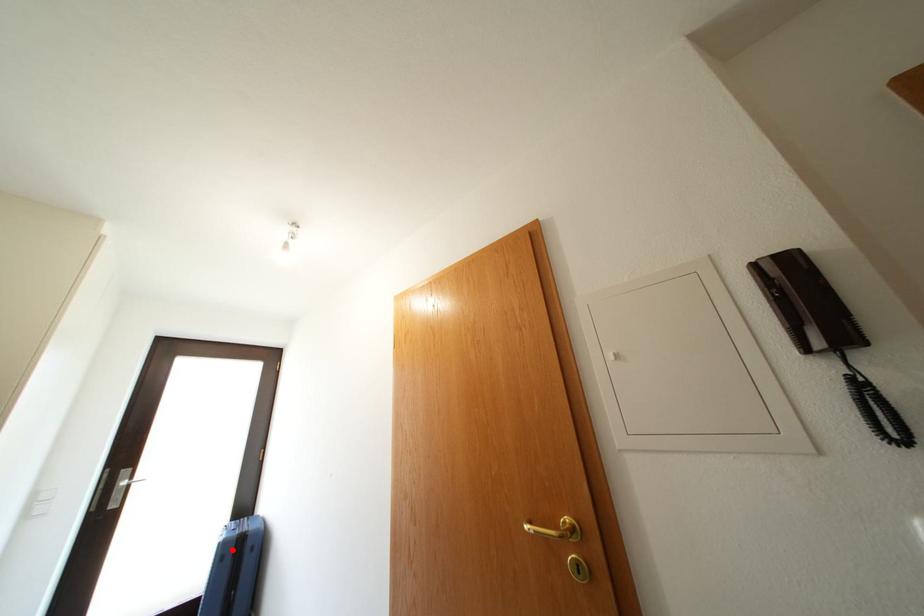
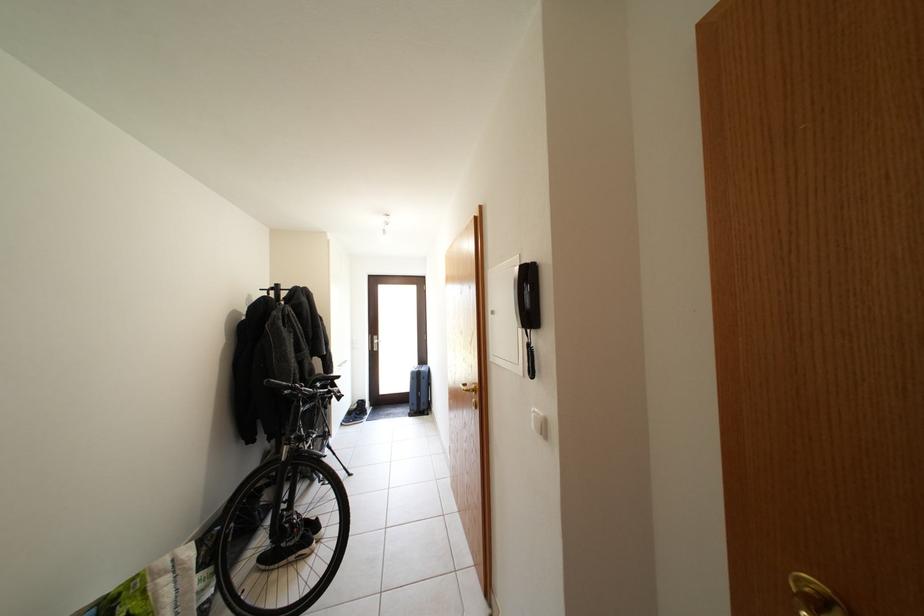
The point at the highlighted location is marked in the first image. Where is the corresponding point in the second image?

(420, 379)